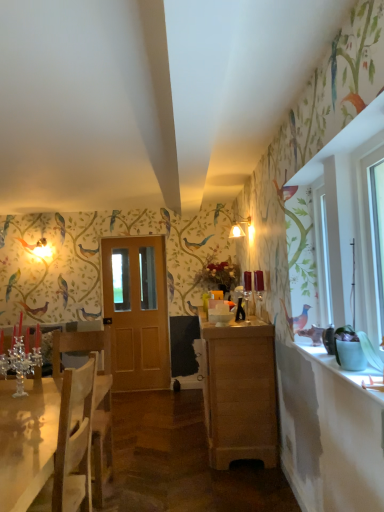
Question: Based on their positions, is light brown wood cabinet at center located to the left or right of white glass window at right?

Choices:
 (A) left
 (B) right

Answer: (A)

Question: Is light brown wood cabinet at center situated inside white glass window at right or outside?

Choices:
 (A) outside
 (B) inside

Answer: (A)

Question: Which object is positioned farthest from the matte white lampshade at center?

Choices:
 (A) white glossy counter top at right
 (B) white wood frame at right
 (C) white glass window at right
 (D) light brown wooden door at center
 (E) shiny wooden table at lower left

Answer: (E)

Question: Which is farther from the white glass window at right?

Choices:
 (A) green matte pot at right
 (B) white wood frame at right
 (C) light brown wood cabinet at center
 (D) white glossy counter top at right
 (E) light brown wooden door at center

Answer: (E)